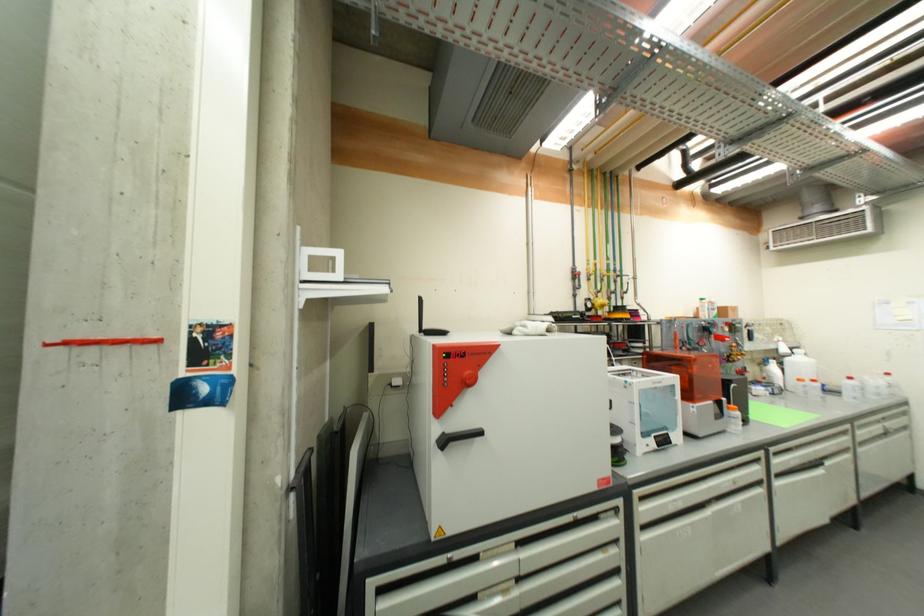
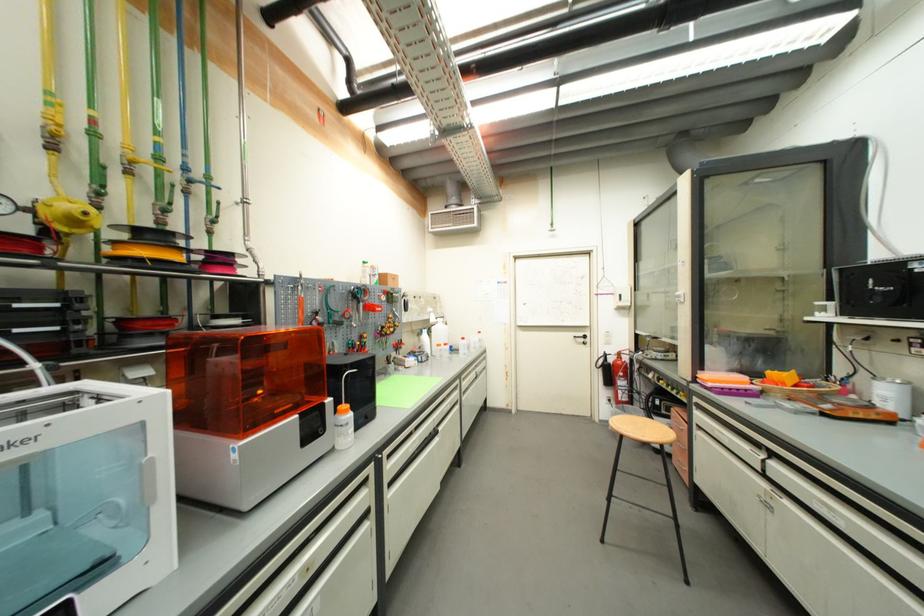
Where in the second image is the point corresponding to [593,265] from the first image?

(55, 106)